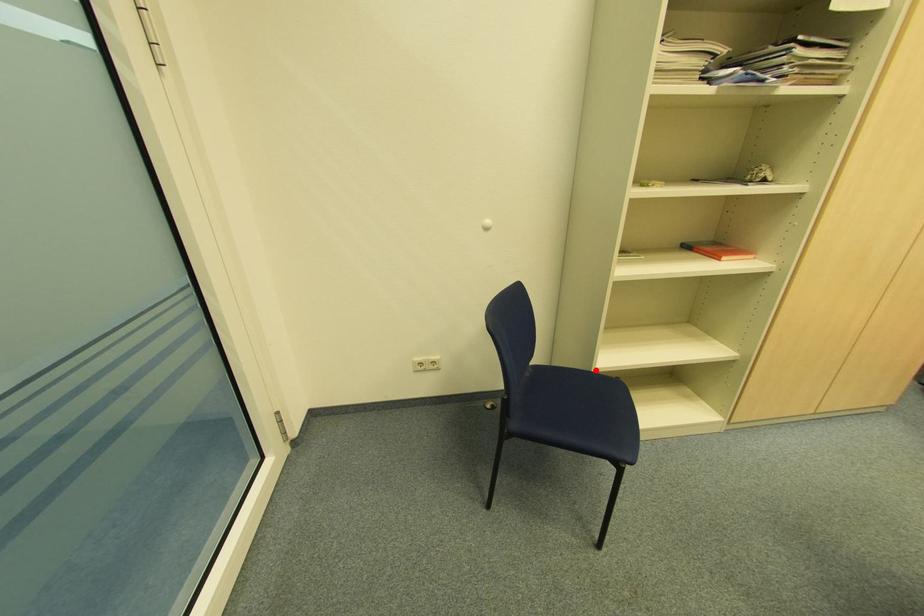
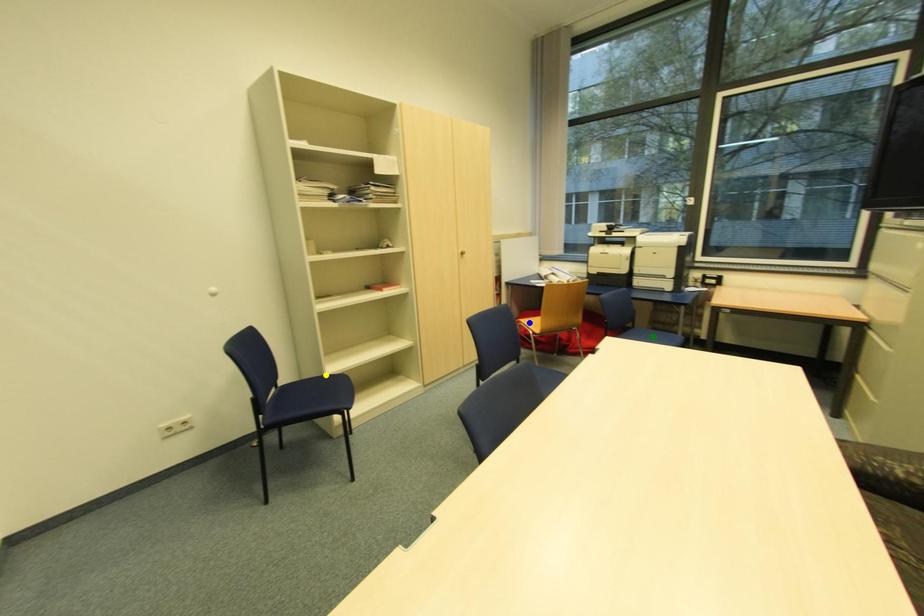
Question: I am providing you with two images of the same scene from different viewpoints. A red point is marked on the first image. You are given multiple points on the second image. Which point in image 2 is actually the same real-world point as the red point in image 1?

Choices:
 (A) blue point
 (B) yellow point
 (C) green point

Answer: (B)